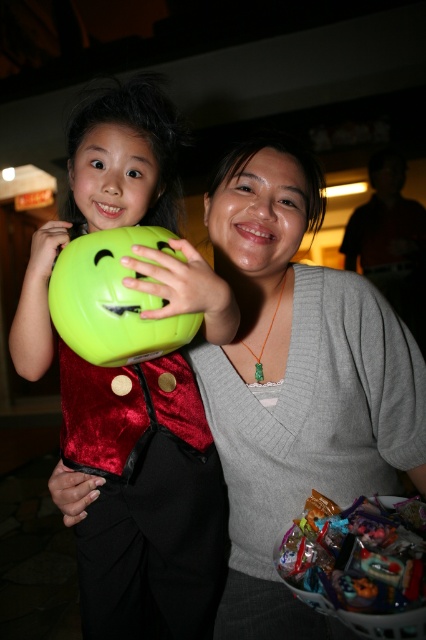
You are standing in front of the scene and need to place a new object exactly at point 0.6, 0.7. Which object from the matte gray sweater at center would you need to move or adjust to make space?

The matte gray sweater at center is located at point (296, 381), so moving it slightly to the right or up would create space at (298, 384).

You are standing in front of the scene and want to touch both the matte gray sweater at center and the green matte balloon at center. Which object should you reach for first to touch the one closer to you?

You should reach for the matte gray sweater at center first because it is closer to you than the green matte balloon at center.